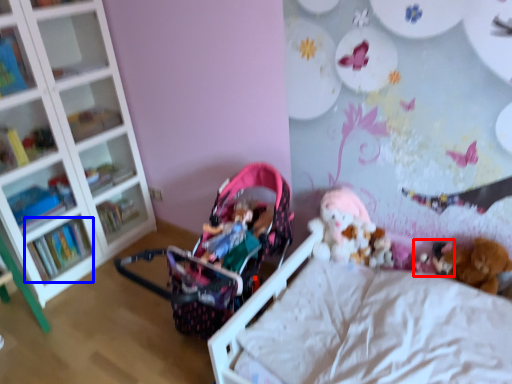
Question: Among these objects, which one is nearest to the camera, toy (highlighted by a red box) or book (highlighted by a blue box)?

Choices:
 (A) toy
 (B) book

Answer: (A)